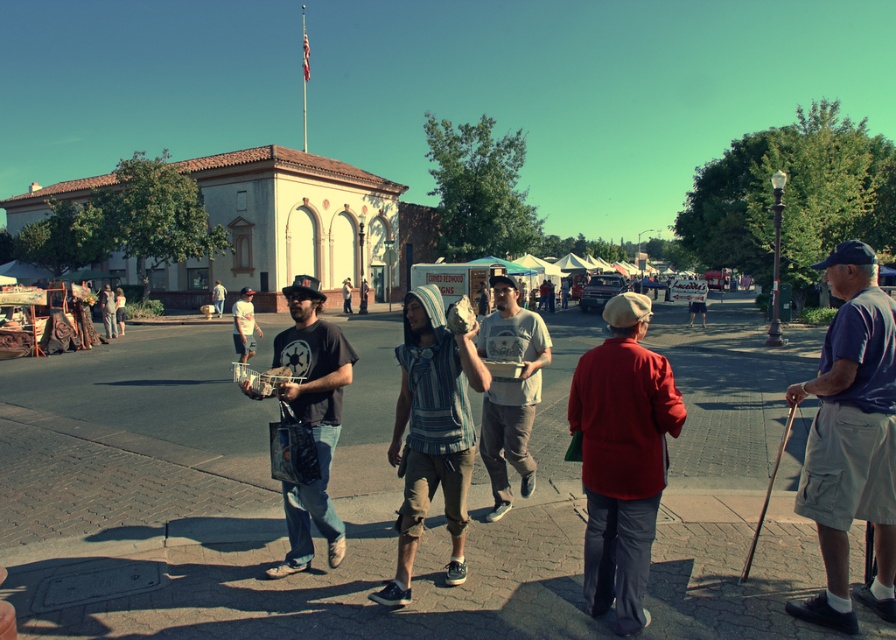
Who is more distant from viewer, (438, 323) or (523, 486)?

Point (523, 486)

Is point (428, 461) farther from viewer compared to point (541, 353)?

No, (428, 461) is in front of (541, 353).

This screenshot has height=640, width=896. In order to click on striped cotton hoodie at center in this screenshot , I will do `click(431, 433)`.

Does blue cotton shirt at right have a larger size compared to matte black t-shirt at center?

No, blue cotton shirt at right is not bigger than matte black t-shirt at center.

Does blue cotton shirt at right appear over matte black t-shirt at center?

Yes.

Locate an element on the screen. blue cotton shirt at right is located at coordinates (851, 440).

This screenshot has height=640, width=896. Identify the location of blue cotton shirt at right. coord(851,440).

Is red cotton jacket at center taller than matte black t-shirt at center?

In fact, red cotton jacket at center may be shorter than matte black t-shirt at center.

Who is more distant from viewer, (x=640, y=432) or (x=349, y=365)?

The point (x=349, y=365) is more distant.

Between point (627, 472) and point (325, 481), which one is positioned behind?

Point (325, 481)

Find the location of a particular element. The height and width of the screenshot is (640, 896). red cotton jacket at center is located at coordinates (622, 458).